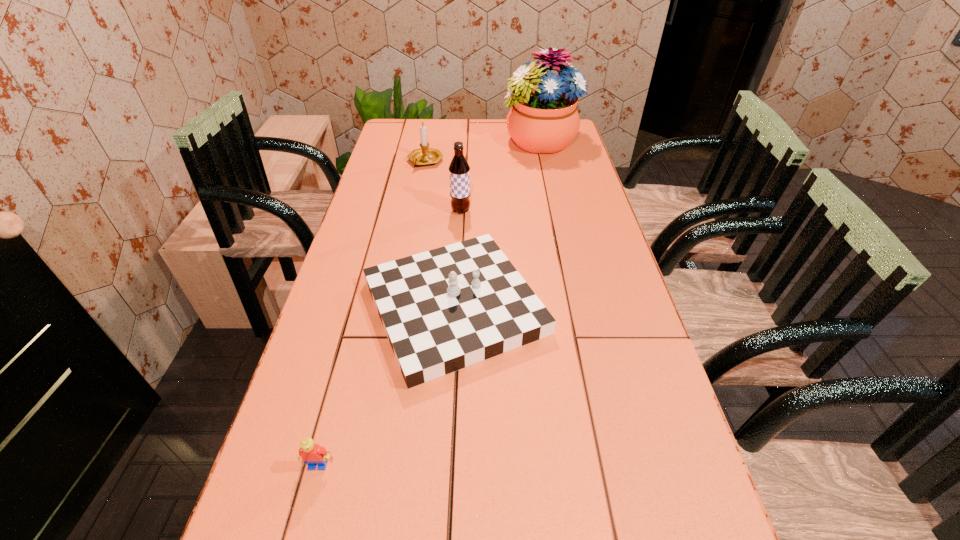
Find the location of `object that is the third closest one to the candle holder`. object that is the third closest one to the candle holder is located at coordinates (445, 309).